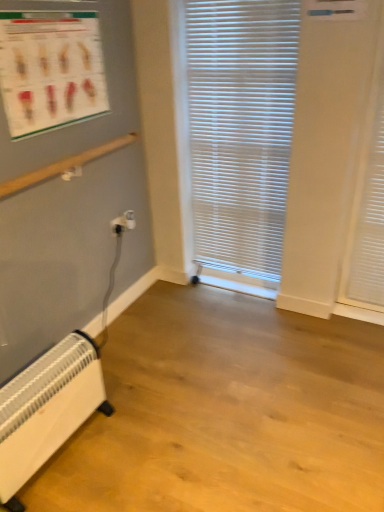
Question: Should I look upward or downward to see white matte shutter at right?

Choices:
 (A) down
 (B) up

Answer: (B)

Question: From the image's perspective, is white plastic blinds at center on top of white plastic electrical outlet at lower left?

Choices:
 (A) no
 (B) yes

Answer: (B)

Question: Can you confirm if white plastic blinds at center is bigger than white plastic electrical outlet at lower left?

Choices:
 (A) yes
 (B) no

Answer: (A)

Question: Are white plastic blinds at center and white plastic electrical outlet at lower left beside each other?

Choices:
 (A) yes
 (B) no

Answer: (B)

Question: Is white plastic blinds at center smaller than white plastic electrical outlet at lower left?

Choices:
 (A) yes
 (B) no

Answer: (B)

Question: Is white plastic blinds at center not within white plastic electrical outlet at lower left?

Choices:
 (A) yes
 (B) no

Answer: (A)

Question: Is white plastic blinds at center at the right side of white plastic electrical outlet at lower left?

Choices:
 (A) no
 (B) yes

Answer: (B)

Question: Is white matte shutter at right looking in the opposite direction of white plastic blinds at center?

Choices:
 (A) yes
 (B) no

Answer: (B)

Question: From a real-world perspective, is white matte shutter at right under white plastic blinds at center?

Choices:
 (A) yes
 (B) no

Answer: (A)

Question: Is white matte shutter at right completely or partially outside of white plastic blinds at center?

Choices:
 (A) yes
 (B) no

Answer: (A)

Question: From the image's perspective, is white matte shutter at right under white plastic blinds at center?

Choices:
 (A) no
 (B) yes

Answer: (B)

Question: Considering the relative positions of white matte shutter at right and white plastic blinds at center in the image provided, is white matte shutter at right to the right of white plastic blinds at center from the viewer's perspective?

Choices:
 (A) no
 (B) yes

Answer: (B)

Question: Considering the relative sizes of white matte shutter at right and white plastic blinds at center in the image provided, is white matte shutter at right shorter than white plastic blinds at center?

Choices:
 (A) yes
 (B) no

Answer: (A)

Question: Can you confirm if matte plastic poster at upper left is smaller than white matte shutter at right?

Choices:
 (A) yes
 (B) no

Answer: (A)